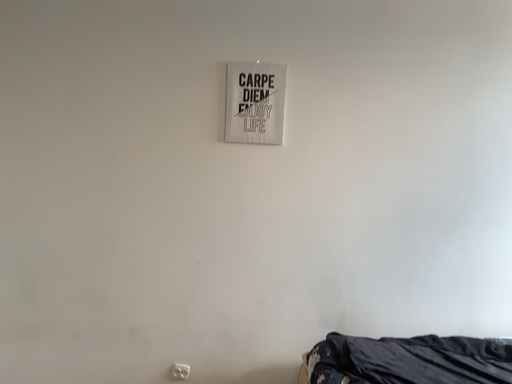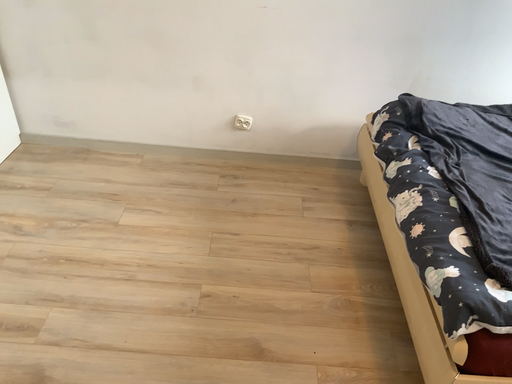
Question: Which way did the camera rotate in the video?

Choices:
 (A) rotated downward
 (B) rotated upward

Answer: (A)